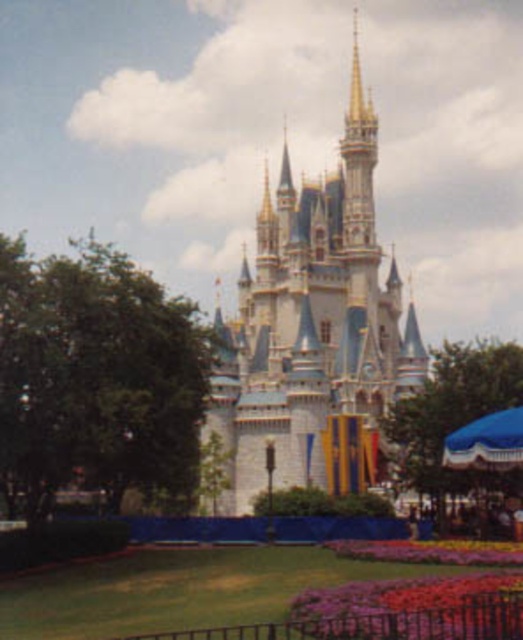
Question: Can you confirm if white glossy castle at center is positioned to the left of purple fabric flower at lower center?

Choices:
 (A) no
 (B) yes

Answer: (B)

Question: Considering the relative positions of vivid multicolored petals at lower center and purple fabric flower at lower center in the image provided, where is vivid multicolored petals at lower center located with respect to purple fabric flower at lower center?

Choices:
 (A) right
 (B) left

Answer: (B)

Question: Which is nearer to the vivid multicolored petals at lower center?

Choices:
 (A) white glossy castle at center
 (B) purple fabric flower at lower center

Answer: (B)

Question: Among these objects, which one is farthest from the camera?

Choices:
 (A) white glossy castle at center
 (B) vivid multicolored petals at lower center

Answer: (A)

Question: Which object is farther from the camera taking this photo?

Choices:
 (A) white glossy castle at center
 (B) purple fabric flower at lower center
 (C) vivid multicolored petals at lower center

Answer: (A)

Question: Does white glossy castle at center have a lesser width compared to purple fabric flower at lower center?

Choices:
 (A) yes
 (B) no

Answer: (B)